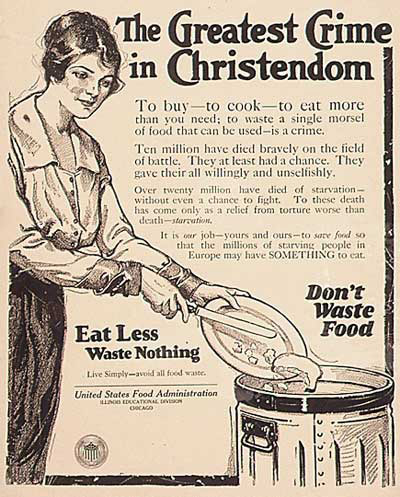
You are a GUI agent. You are given a task and a screenshot of the screen. Output one action in this format:
    pyautogui.click(x=<x>, y=<y>)
    Task: Click on the handle
    Image resolution: width=400 pixels, height=497 pixels.
    Given the screenshot: What is the action you would take?
    pyautogui.click(x=270, y=433)